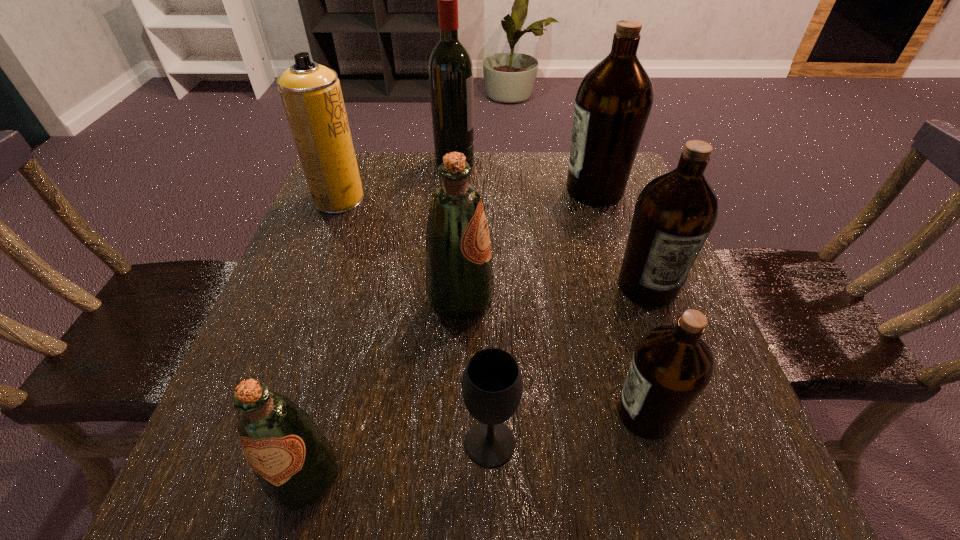
The width and height of the screenshot is (960, 540). Identify the location of vacant space located 0.350m on the label of the smallest brown olive oil. (383, 414).

This screenshot has width=960, height=540. I want to click on vacant point located 0.260m on the left of the shortest object, so click(284, 443).

Locate an element on the screen. The image size is (960, 540). wine bottle that is at the far edge is located at coordinates (450, 66).

Locate an element on the screen. Image resolution: width=960 pixels, height=540 pixels. olive oil that is at the far edge is located at coordinates pyautogui.click(x=613, y=102).

The width and height of the screenshot is (960, 540). What are the coordinates of `aerosol can that is at the far edge` in the screenshot? It's located at (311, 94).

Locate an element on the screen. olive oil that is at the near edge is located at coordinates (294, 462).

This screenshot has width=960, height=540. I want to click on wineglass present at the near edge, so click(x=492, y=385).

I want to click on aerosol can located in the left edge section of the desktop, so click(311, 94).

I want to click on olive oil that is at the left edge, so click(x=294, y=462).

Where is `object at the far left corner`? The width and height of the screenshot is (960, 540). object at the far left corner is located at coordinates (311, 94).